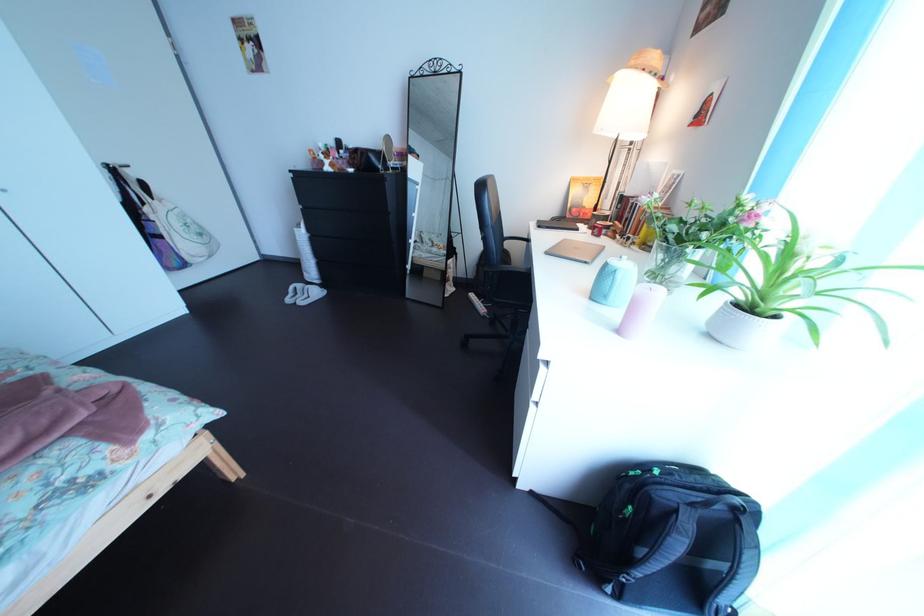
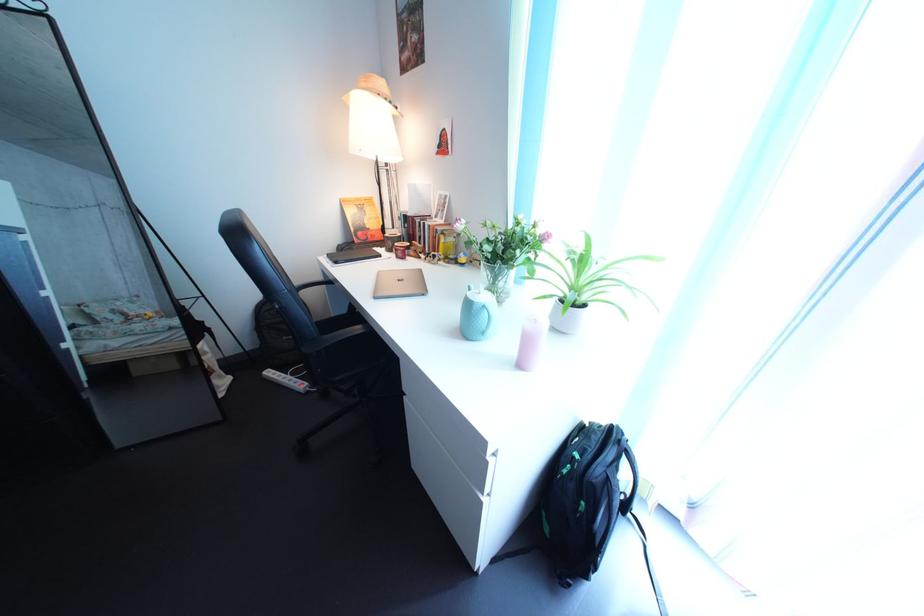
The point at (596, 244) is marked in the first image. Where is the corresponding point in the second image?

(402, 269)